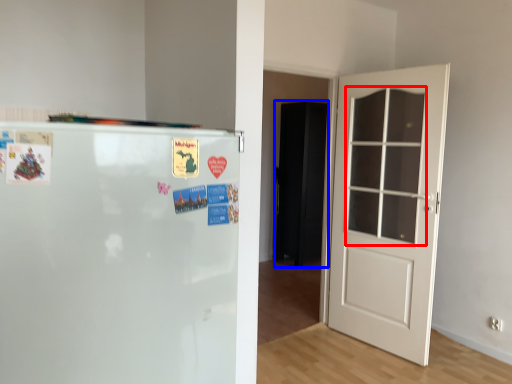
Question: Which of the following is the farthest to the observer, window (highlighted by a red box) or armoire (highlighted by a blue box)?

Choices:
 (A) window
 (B) armoire

Answer: (B)